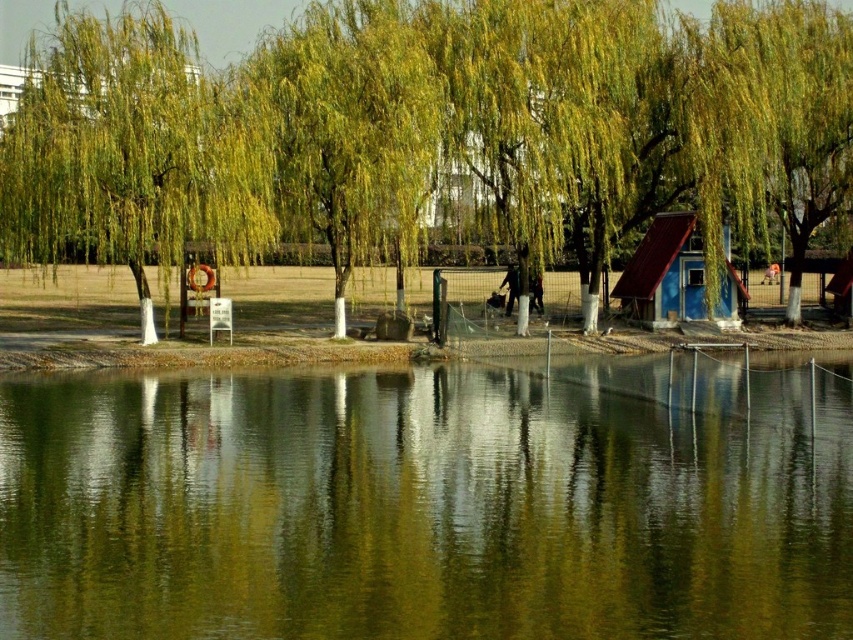
Locate an element on the screen. The width and height of the screenshot is (853, 640). green leafy tree at center is located at coordinates (230, 22).

What do you see at coordinates (230, 22) in the screenshot? Image resolution: width=853 pixels, height=640 pixels. I see `green leafy tree at center` at bounding box center [230, 22].

Where is `green leafy tree at center`? green leafy tree at center is located at coordinates click(230, 22).

Looking at this image, can you confirm if green leafy willow at right is positioned to the right of blue painted wood hut at right?

Indeed, green leafy willow at right is positioned on the right side of blue painted wood hut at right.

Is green leafy willow at right to the left of blue painted wood hut at right from the viewer's perspective?

No, green leafy willow at right is not to the left of blue painted wood hut at right.

Which is in front, point (712, 100) or point (642, 266)?

Point (712, 100)

Find the location of a particular element. The width and height of the screenshot is (853, 640). green leafy willow at right is located at coordinates (772, 118).

Which is more to the left, green reflective water at center or green leafy willow at right?

Positioned to the left is green reflective water at center.

Is point (152, 547) behind point (804, 173)?

No, (152, 547) is in front of (804, 173).

In order to click on green reflective water at center in this screenshot , I will do `click(428, 502)`.